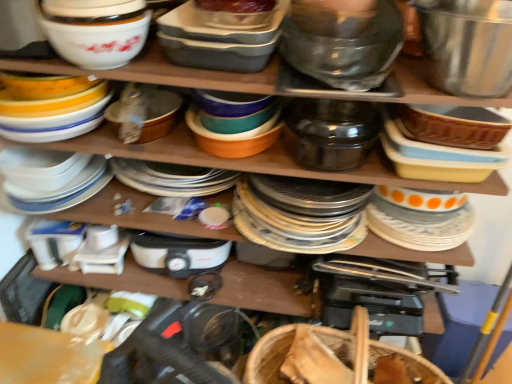
Question: In the image, is translucent plastic container at upper center, which is the 2th bowl in left-to-right order, on the left side or the right side of white glossy bowl at upper left, the 2th appliance when ordered from right to left?

Choices:
 (A) left
 (B) right

Answer: (B)

Question: Is translucent plastic container at upper center, which is the 3th bowl in right-to-left order, situated inside white glossy bowl at upper left, the 2th appliance when ordered from right to left, or outside?

Choices:
 (A) outside
 (B) inside

Answer: (A)

Question: Considering the real-world distances, which object is closest to the transparent plastic bowl at upper center, marked as the 3th bowl in a left-to-right arrangement?

Choices:
 (A) satin black pot at center, which is the 1th appliance in right-to-left order
 (B) translucent plastic container at upper center, which is the 2th bowl in left-to-right order
 (C) white glossy plate at upper right
 (D) bamboo weave basket at lower center
 (E) white glossy bowl at upper left, positioned as the 1th appliance in left-to-right order

Answer: (B)

Question: Which of these objects is positioned farthest from the white glossy plate at upper right?

Choices:
 (A) satin black pot at center, which is the 1th appliance in right-to-left order
 (B) shiny metallic bowl at upper right, arranged as the first bowl when viewed from the right
 (C) bamboo weave basket at lower center
 (D) transparent plastic bowl at upper center, marked as the 3th bowl in a left-to-right arrangement
 (E) white glossy bowl at upper left, positioned as the 1th appliance in left-to-right order

Answer: (E)